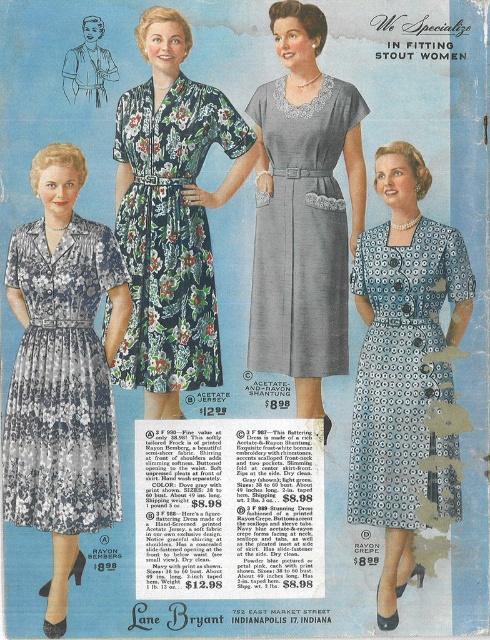
Which is behind, point (441, 376) or point (326, 83)?

Point (326, 83)

Who is taller, blue printed fabric dress at center or gray acetate dress at center?

blue printed fabric dress at center is taller.

Who is more distant from viewer, (430, 227) or (328, 333)?

The point (328, 333) is more distant.

This screenshot has width=490, height=640. What are the coordinates of `blue printed fabric dress at center` in the screenshot? It's located at (403, 372).

Which is above, printed cotton dress at left or floral print rayon dress at center?

Positioned higher is floral print rayon dress at center.

Does point (71, 227) lie behind point (122, 227)?

No, it is in front of (122, 227).

You are a GUI agent. You are given a task and a screenshot of the screen. Output one action in this format:
    pyautogui.click(x=<x>, y=<y>)
    Task: Click on the printed cotton dress at left
    
    Given the screenshot: What is the action you would take?
    pyautogui.click(x=62, y=384)

Does printed cotton dress at left have a greater height compared to gray acetate dress at center?

Correct, printed cotton dress at left is much taller as gray acetate dress at center.

Which is above, printed cotton dress at left or gray acetate dress at center?

gray acetate dress at center is higher up.

Find the location of a particular element. This screenshot has height=640, width=490. printed cotton dress at left is located at coordinates (62, 384).

In order to click on printed cotton dress at left in this screenshot , I will do `click(62, 384)`.